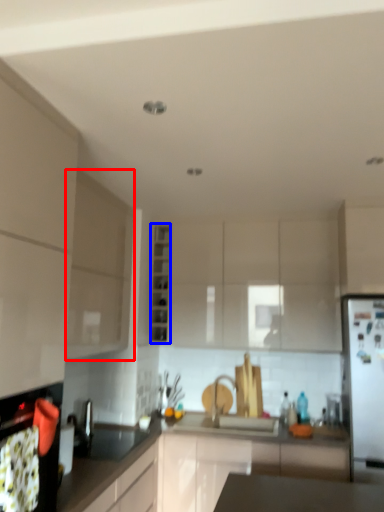
Question: Which of the following is the farthest to the observer, cabinetry (highlighted by a red box) or cabinetry (highlighted by a blue box)?

Choices:
 (A) cabinetry
 (B) cabinetry

Answer: (B)